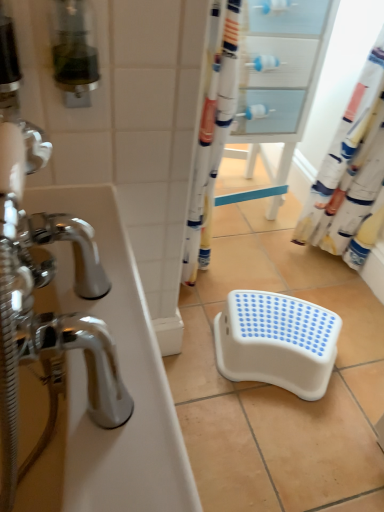
The image size is (384, 512). I want to click on vacant space behind white plastic step stool at center, so click(x=286, y=278).